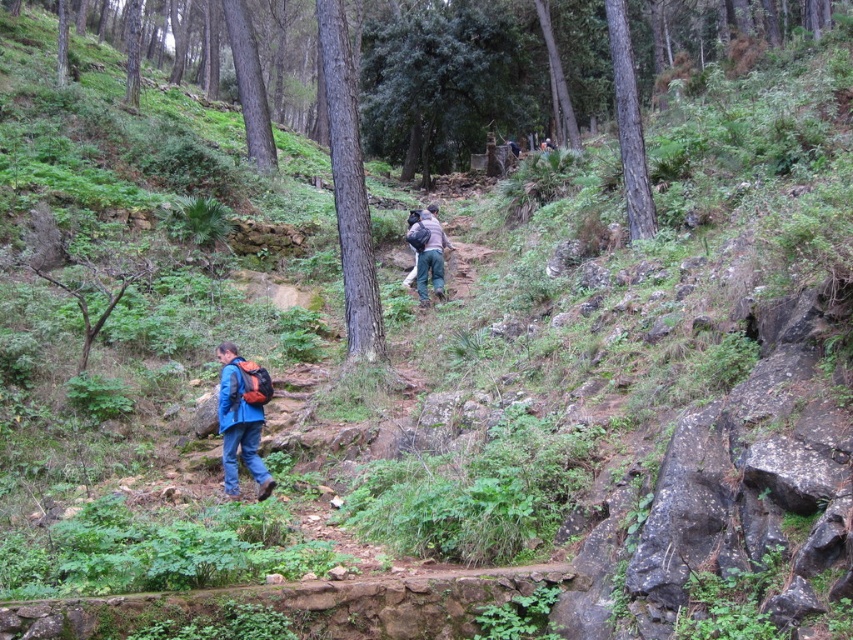
Question: Can you confirm if matte blue jacket at lower left is bigger than dark brown backpack at center?

Choices:
 (A) yes
 (B) no

Answer: (B)

Question: Which object is farther from the camera taking this photo?

Choices:
 (A) dark brown backpack at center
 (B) matte blue jacket at lower left

Answer: (A)

Question: Can you confirm if matte blue jacket at lower left is thinner than dark brown backpack at center?

Choices:
 (A) no
 (B) yes

Answer: (B)

Question: Which point is closer to the camera taking this photo?

Choices:
 (A) (253, 433)
 (B) (416, 262)

Answer: (A)

Question: Can you confirm if matte blue jacket at lower left is positioned below dark brown backpack at center?

Choices:
 (A) yes
 (B) no

Answer: (A)